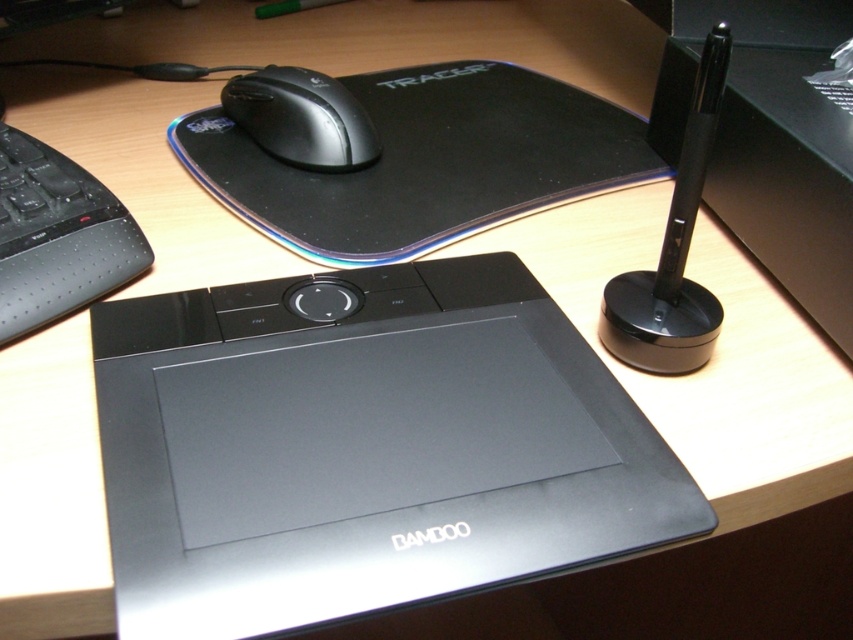
Please provide the 2D coordinates of the black rubber mousepad at upper center in the workspace setup.

The 2D coordinates of the black rubber mousepad at upper center are at point [425,161].

You are a photographer setting up a tripod to capture a closeup of the matte black tablet at center. The tripod requires at least 12 inches of clearance between the camera and the subject. Is the current distance sufficient?

The matte black tablet at center is 12.70 inches from viewer, so yes, the current distance of 12.70 inches is sufficient as it exceeds the required 12 inches clearance.

You are setting up your workspace and need to place a new wireless charger between the matte black tablet at center and the matte black mouse at upper center. Based on their current positions, where should you place the wireless charger to ensure it is between them?

The matte black tablet at center is positioned on the right side of the matte black mouse at upper center, so you should place the wireless charger to the left of the matte black tablet at center and to the right of the matte black mouse at upper center to ensure it is between them.